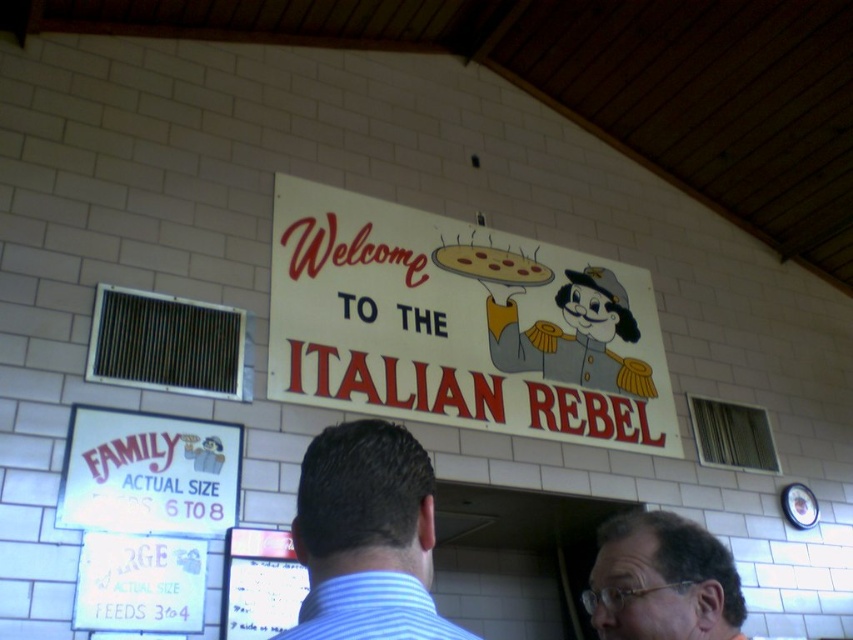
You are a customer at The Italian Rebel restaurant and want to know which object is taller between the dark brown hair at center and the matte yellow pizza at center. Based on the scene description, which one is taller?

The matte yellow pizza at center is taller than the dark brown hair at center.

What is the color of the hair at the point with coordinates (x=662, y=580)?

The point at coordinates (x=662, y=580) is on dark brown hair at center.

You are a customer looking at the menu signs outside the restaurant. You notice the dark brown hair at center and the matte yellow pizza at center. Which object appears to be wider in the image?

The matte yellow pizza at center is wider than the dark brown hair at center.